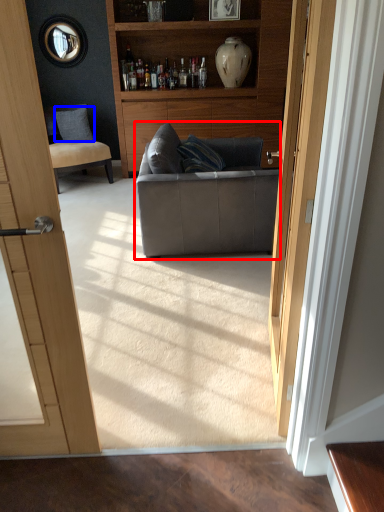
Question: Which point is further to the camera, studio couch (highlighted by a red box) or pillow (highlighted by a blue box)?

Choices:
 (A) studio couch
 (B) pillow

Answer: (B)